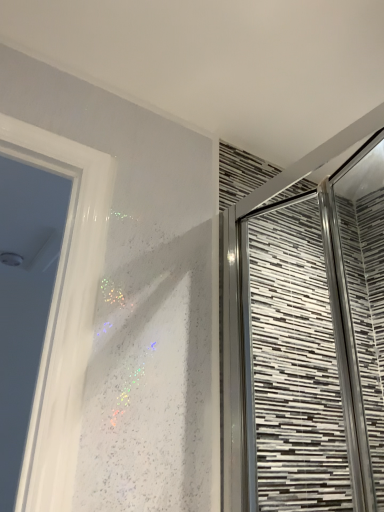
The height and width of the screenshot is (512, 384). Describe the element at coordinates (313, 343) in the screenshot. I see `metallic textured glass at right` at that location.

Find the location of `metallic textured glass at right`. metallic textured glass at right is located at coordinates (313, 343).

The width and height of the screenshot is (384, 512). Find the location of `metallic textured glass at right`. metallic textured glass at right is located at coordinates (313, 343).